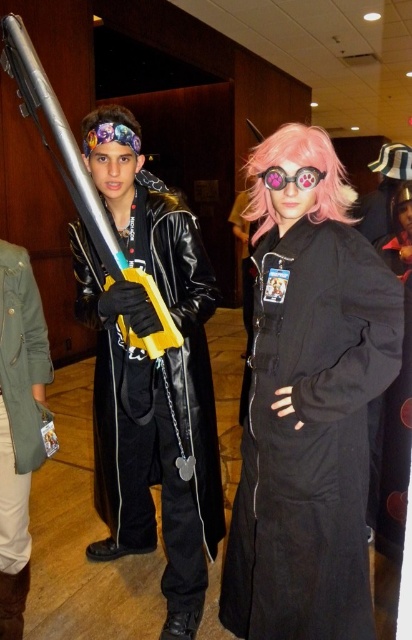
You are a photographer at a cosplay event. You want to take a photo of the pink silky hair at center. Where should you focus your camera to capture it accurately?

The pink silky hair at center is located at the 2D coordinates point (400, 209), so focus the camera there to capture it accurately.